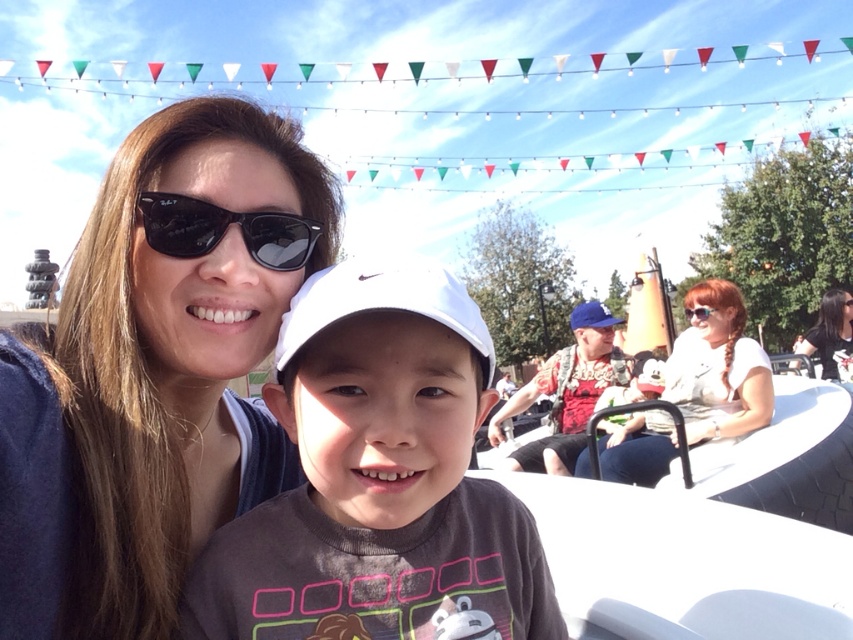
Looking at this image, who is positioned more to the left, white fabric shirt at center or black matte sunglasses at upper left?

black matte sunglasses at upper left is more to the left.

Is white fabric shirt at center further to camera compared to black matte sunglasses at upper left?

Yes, white fabric shirt at center is behind black matte sunglasses at upper left.

Is point (622, 449) farther from viewer compared to point (222, 214)?

Yes, point (622, 449) is farther from viewer.

Locate an element on the screen. The width and height of the screenshot is (853, 640). white fabric shirt at center is located at coordinates (717, 365).

Is black matte sunglasses at upper left shorter than dark brown hair at upper right?

Correct, black matte sunglasses at upper left is not as tall as dark brown hair at upper right.

Between point (292, 262) and point (820, 330), which one is positioned behind?

Point (820, 330)

Locate an element on the screen. This screenshot has width=853, height=640. black matte sunglasses at upper left is located at coordinates (225, 228).

Who is more forward, [144,204] or [596,317]?

Point [144,204]

Does black matte sunglasses at upper left appear on the right side of blue fabric baseball cap at center?

Incorrect, black matte sunglasses at upper left is not on the right side of blue fabric baseball cap at center.

Locate an element on the screen. The width and height of the screenshot is (853, 640). black matte sunglasses at upper left is located at coordinates (225, 228).

Locate an element on the screen. The width and height of the screenshot is (853, 640). black matte sunglasses at upper left is located at coordinates (225, 228).